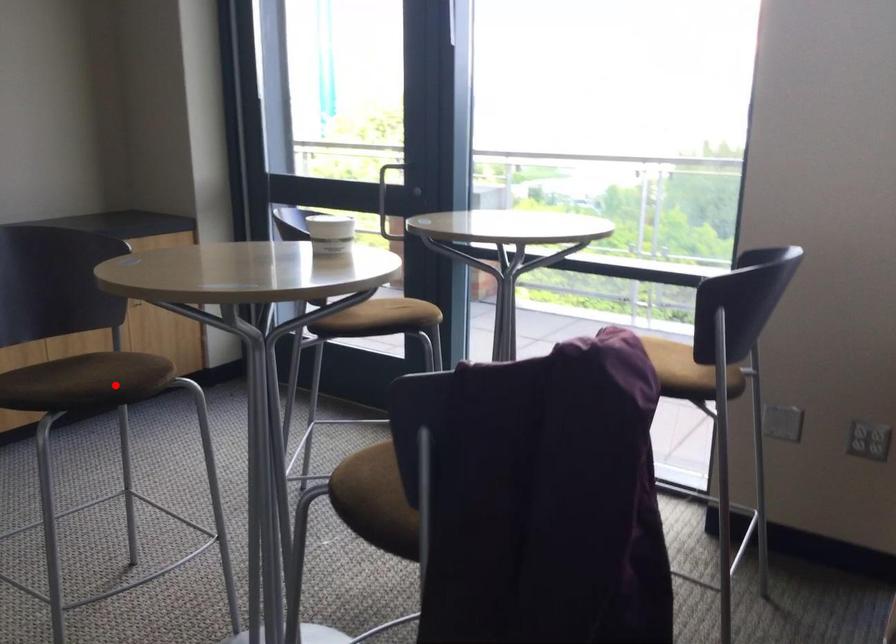
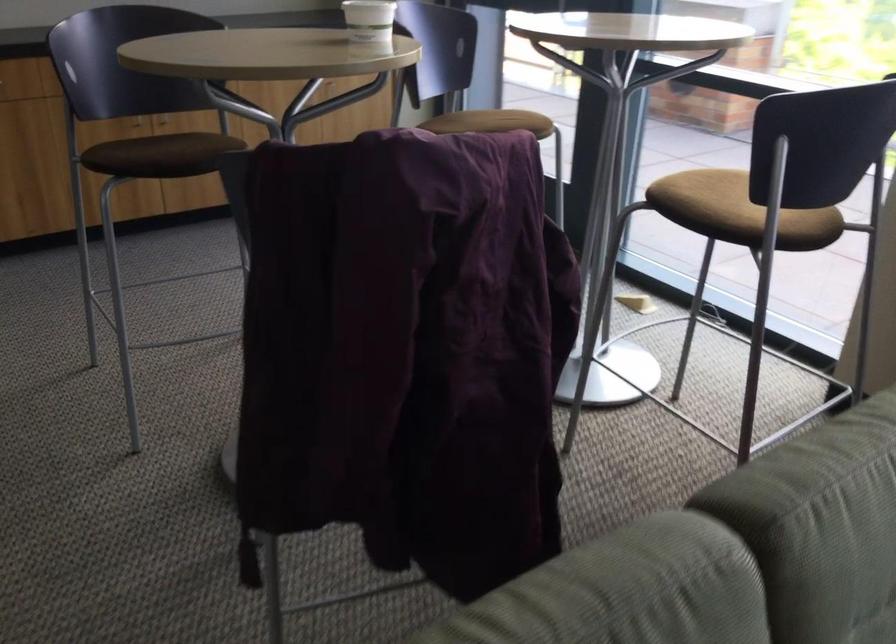
The point at the highlighted location is marked in the first image. Where is the corresponding point in the second image?

(173, 160)